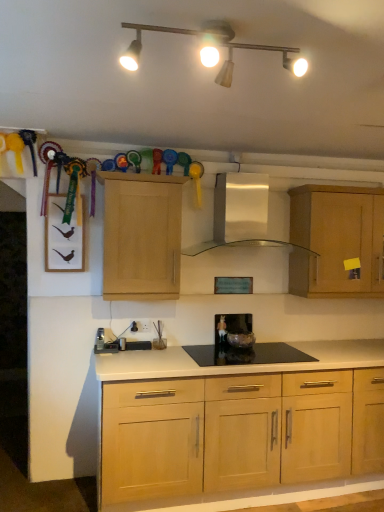
This screenshot has width=384, height=512. What do you see at coordinates (141, 236) in the screenshot?
I see `light wood cabinet at center, arranged as the 1th cabinetry when viewed from the left` at bounding box center [141, 236].

In order to face light wood cabinet at center, the 1th cabinetry viewed from the front, should I rotate leftwards or rightwards?

It's best to rotate left around 6.705 degrees.

Measure the distance between point (251,47) and camera.

A distance of 4.78 feet exists between point (251,47) and camera.

What do you see at coordinates (336, 240) in the screenshot? I see `light wood cabinet at upper right, which is counted as the 2th cabinetry, starting from the front` at bounding box center [336, 240].

Image resolution: width=384 pixels, height=512 pixels. I want to click on white plastic electric outlet at lower center, so click(x=140, y=326).

This screenshot has width=384, height=512. Find the location of `light wood cabinet at center, the 2th cabinetry positioned from the right`. light wood cabinet at center, the 2th cabinetry positioned from the right is located at coordinates click(x=141, y=236).

Which of these two, white glossy range hood at center or black glass gas stove at center, stands shorter?

black glass gas stove at center is shorter.

In the image, is white glossy range hood at center on the left side or the right side of black glass gas stove at center?

Clearly, white glossy range hood at center is on the left of black glass gas stove at center in the image.

Is white glossy range hood at center located outside black glass gas stove at center?

white glossy range hood at center is positioned outside black glass gas stove at center.

Considering the sizes of satin silver toaster at lower left, arranged as the second appliance when viewed from the back, and black glass gas stove at center in the image, is satin silver toaster at lower left, arranged as the second appliance when viewed from the back, bigger or smaller than black glass gas stove at center?

satin silver toaster at lower left, arranged as the second appliance when viewed from the back, is smaller than black glass gas stove at center.

Is satin silver toaster at lower left, arranged as the second appliance when viewed from the back, inside the boundaries of black glass gas stove at center, or outside?

satin silver toaster at lower left, arranged as the second appliance when viewed from the back, cannot be found inside black glass gas stove at center.

Based on the photo, does satin silver toaster at lower left, acting as the first appliance starting from the front, have a greater height compared to black glass gas stove at center?

Indeed, satin silver toaster at lower left, acting as the first appliance starting from the front, has a greater height compared to black glass gas stove at center.

Does satin silver toaster at lower left, arranged as the second appliance when viewed from the back, have a greater width compared to black glass gas stove at center?

No, satin silver toaster at lower left, arranged as the second appliance when viewed from the back, is not wider than black glass gas stove at center.

Are light wood cabinet at center, the 1th cabinetry viewed from the front, and satin silver toaster at lower left, the 1th appliance viewed from the left, far apart?

No, light wood cabinet at center, the 1th cabinetry viewed from the front, is not far from satin silver toaster at lower left, the 1th appliance viewed from the left.

From the image's perspective, is light wood cabinet at center, the 1th cabinetry viewed from the front, on satin silver toaster at lower left, the 1th appliance viewed from the left?

Yes, from the image's perspective, light wood cabinet at center, the 1th cabinetry viewed from the front, is on top of satin silver toaster at lower left, the 1th appliance viewed from the left.

Is light wood cabinet at center, the 1th cabinetry viewed from the front, located outside satin silver toaster at lower left, arranged as the second appliance when viewed from the back?

That's correct, light wood cabinet at center, the 1th cabinetry viewed from the front, is outside of satin silver toaster at lower left, arranged as the second appliance when viewed from the back.

Considering the sizes of objects light wood cabinet at center, which appears as the 2th cabinetry when viewed from the back, and satin silver toaster at lower left, acting as the first appliance starting from the front, in the image provided, who is shorter, light wood cabinet at center, which appears as the 2th cabinetry when viewed from the back, or satin silver toaster at lower left, acting as the first appliance starting from the front,?

satin silver toaster at lower left, acting as the first appliance starting from the front.

Considering the sizes of objects black glass gas stove at center and white plastic electric outlet at lower center in the image provided, who is bigger, black glass gas stove at center or white plastic electric outlet at lower center?

Bigger between the two is black glass gas stove at center.

Between black glass gas stove at center and white plastic electric outlet at lower center, which one has larger width?

black glass gas stove at center is wider.

Which is more to the right, black glass gas stove at center or white plastic electric outlet at lower center?

black glass gas stove at center.

In the image, is black glass gas stove at center positioned in front of or behind white plastic electric outlet at lower center?

In the image, black glass gas stove at center appears in front of white plastic electric outlet at lower center.

Could you tell me if matte glass bowl at center, the 1th appliance viewed from the right, is turned towards white plastic electric outlet at lower center?

No, matte glass bowl at center, the 1th appliance viewed from the right, is not facing towards white plastic electric outlet at lower center.

From a real-world perspective, which is physically below, matte glass bowl at center, which is counted as the 1th appliance, starting from the back, or white plastic electric outlet at lower center?

matte glass bowl at center, which is counted as the 1th appliance, starting from the back, from a real-world perspective.

Considering their positions, is matte glass bowl at center, the 1th appliance viewed from the right, located in front of or behind white plastic electric outlet at lower center?

In the image, matte glass bowl at center, the 1th appliance viewed from the right, appears behind white plastic electric outlet at lower center.

Considering the positions of objects white plastic electric outlet at lower center and matte glass bowl at center, which is the second appliance from left to right, in the image provided, who is behind, white plastic electric outlet at lower center or matte glass bowl at center, which is the second appliance from left to right,?

matte glass bowl at center, which is the second appliance from left to right, is behind.

Could you tell me if white plastic electric outlet at lower center is facing matte glass bowl at center, which is counted as the 1th appliance, starting from the back?

No, white plastic electric outlet at lower center is not aimed at matte glass bowl at center, which is counted as the 1th appliance, starting from the back.

Considering the relative sizes of white plastic electric outlet at lower center and matte glass bowl at center, the 1th appliance viewed from the right, in the image provided, is white plastic electric outlet at lower center taller than matte glass bowl at center, the 1th appliance viewed from the right,?

No, white plastic electric outlet at lower center is not taller than matte glass bowl at center, the 1th appliance viewed from the right.

Between white plastic electric outlet at lower center and matte glass bowl at center, which is counted as the 1th appliance, starting from the back, which one has larger width?

With larger width is matte glass bowl at center, which is counted as the 1th appliance, starting from the back.

Does light wood cabinet at upper right, which is the 1th cabinetry in right-to-left order, have a greater height compared to matte white track lights at upper center?

Correct, light wood cabinet at upper right, which is the 1th cabinetry in right-to-left order, is much taller as matte white track lights at upper center.

Is light wood cabinet at upper right, which ranks as the second cabinetry in left-to-right order, positioned beyond the bounds of matte white track lights at upper center?

Yes.

Between light wood cabinet at upper right, which is the 1th cabinetry in right-to-left order, and matte white track lights at upper center, which one has smaller size?

matte white track lights at upper center.

Where is `gas stove that appears in front of the white glossy range hood at center`? gas stove that appears in front of the white glossy range hood at center is located at coordinates (246, 354).

Where is `gas stove below the satin silver toaster at lower left, acting as the first appliance starting from the front (from the image's perspective)`? The width and height of the screenshot is (384, 512). gas stove below the satin silver toaster at lower left, acting as the first appliance starting from the front (from the image's perspective) is located at coordinates (246, 354).

In the scene shown: Estimate the real-world distances between objects in this image. Which object is further from matte white track lights at upper center, black glass gas stove at center or satin silver toaster at lower left, the 1th appliance viewed from the left?

Based on the image, satin silver toaster at lower left, the 1th appliance viewed from the left, appears to be further to matte white track lights at upper center.

Consider the image. Estimate the real-world distances between objects in this image. Which object is closer to white glossy range hood at center, light wood cabinet at center, which appears as the 2th cabinetry when viewed from the back, or satin silver toaster at lower left, arranged as the second appliance when viewed from the back?

light wood cabinet at center, which appears as the 2th cabinetry when viewed from the back, is closer to white glossy range hood at center.

Based on their spatial positions, is white glossy range hood at center or satin silver toaster at lower left, positioned as the second appliance in right-to-left order, closer to light wood cabinet at upper right, which is counted as the 2th cabinetry, starting from the front?

white glossy range hood at center is positioned closer to the anchor light wood cabinet at upper right, which is counted as the 2th cabinetry, starting from the front.

Estimate the real-world distances between objects in this image. Which object is closer to light wood cabinet at upper right, which is counted as the 2th cabinetry, starting from the front, light wood cabinet at center, the 2th cabinetry positioned from the right, or black glass gas stove at center?

black glass gas stove at center lies closer to light wood cabinet at upper right, which is counted as the 2th cabinetry, starting from the front, than the other object.

Which object lies further to the anchor point white plastic electric outlet at lower center, light wood cabinet at center, which appears as the 2th cabinetry when viewed from the back, or matte white track lights at upper center?

matte white track lights at upper center is further to white plastic electric outlet at lower center.

Considering their positions, is matte glass bowl at center, which is the second appliance from left to right, positioned closer to satin silver toaster at lower left, the 1th appliance viewed from the left, than matte white track lights at upper center?

matte glass bowl at center, which is the second appliance from left to right, lies closer to satin silver toaster at lower left, the 1th appliance viewed from the left, than the other object.

When comparing their distances from matte white track lights at upper center, does matte glass bowl at center, which is counted as the 1th appliance, starting from the back, or black glass gas stove at center seem further?

The object further to matte white track lights at upper center is matte glass bowl at center, which is counted as the 1th appliance, starting from the back.

Estimate the real-world distances between objects in this image. Which object is closer to white glossy range hood at center, white plastic electric outlet at lower center or light wood cabinet at upper right, which is counted as the 2th cabinetry, starting from the front?

light wood cabinet at upper right, which is counted as the 2th cabinetry, starting from the front, is positioned closer to the anchor white glossy range hood at center.

What are the coordinates of `appliance situated between white plastic electric outlet at lower center and light wood cabinet at upper right, which is the 1th cabinetry in right-to-left order, from left to right` in the screenshot? It's located at (233, 329).

The width and height of the screenshot is (384, 512). In order to click on electric outlet between light wood cabinet at center, the 2th cabinetry positioned from the right, and satin silver toaster at lower left, the 1th appliance viewed from the left, in the vertical direction in this screenshot , I will do `click(140, 326)`.

The width and height of the screenshot is (384, 512). Identify the location of cabinetry situated between satin silver toaster at lower left, acting as the first appliance starting from the front, and white glossy range hood at center from left to right. (141, 236).

What are the coordinates of `electric outlet between satin silver toaster at lower left, arranged as the second appliance when viewed from the back, and light wood cabinet at upper right, which ranks as the second cabinetry in left-to-right order, from left to right` in the screenshot? It's located at (140, 326).